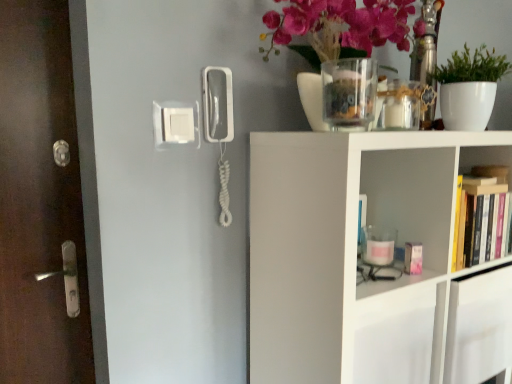
Question: Is matte glass vase at upper center taller than white matte plant at upper right?

Choices:
 (A) no
 (B) yes

Answer: (B)

Question: Is matte glass vase at upper center smaller than white matte plant at upper right?

Choices:
 (A) yes
 (B) no

Answer: (B)

Question: Is matte glass vase at upper center at the right side of white matte plant at upper right?

Choices:
 (A) no
 (B) yes

Answer: (A)

Question: From the image's perspective, is matte glass vase at upper center under white matte plant at upper right?

Choices:
 (A) no
 (B) yes

Answer: (A)

Question: From a real-world perspective, is matte glass vase at upper center located higher than white matte plant at upper right?

Choices:
 (A) yes
 (B) no

Answer: (A)

Question: From a real-world perspective, relative to white plastic phone at center, is white matte shelf at upper right, the first shelf in the bottom-to-top sequence, vertically above or below?

Choices:
 (A) below
 (B) above

Answer: (A)

Question: From their relative heights in the image, would you say white matte shelf at upper right, the first shelf in the bottom-to-top sequence, is taller or shorter than white plastic phone at center?

Choices:
 (A) short
 (B) tall

Answer: (B)

Question: Considering the positions of white matte shelf at upper right, the 2th shelf when ordered from top to bottom, and white plastic phone at center in the image, is white matte shelf at upper right, the 2th shelf when ordered from top to bottom, bigger or smaller than white plastic phone at center?

Choices:
 (A) big
 (B) small

Answer: (A)

Question: Which is correct: white matte shelf at upper right, the first shelf in the bottom-to-top sequence, is inside white plastic phone at center, or outside of it?

Choices:
 (A) outside
 (B) inside

Answer: (A)

Question: Choose the correct answer: Is hardcover books at right, the first shelf viewed from the top, inside clear glass vase at upper center or outside it?

Choices:
 (A) outside
 (B) inside

Answer: (A)

Question: Considering the positions of hardcover books at right, the first shelf viewed from the top, and clear glass vase at upper center in the image, is hardcover books at right, the first shelf viewed from the top, bigger or smaller than clear glass vase at upper center?

Choices:
 (A) small
 (B) big

Answer: (B)

Question: In the image, is hardcover books at right, the first shelf viewed from the top, positioned in front of or behind clear glass vase at upper center?

Choices:
 (A) behind
 (B) front

Answer: (A)

Question: In terms of width, does hardcover books at right, which is counted as the second shelf, starting from the bottom, look wider or thinner when compared to clear glass vase at upper center?

Choices:
 (A) thin
 (B) wide

Answer: (A)

Question: Is white matte shelf at upper right, the 2th shelf when ordered from top to bottom, to the left or to the right of matte glass vase at upper center in the image?

Choices:
 (A) right
 (B) left

Answer: (A)

Question: In terms of size, does white matte shelf at upper right, the 2th shelf when ordered from top to bottom, appear bigger or smaller than matte glass vase at upper center?

Choices:
 (A) small
 (B) big

Answer: (B)